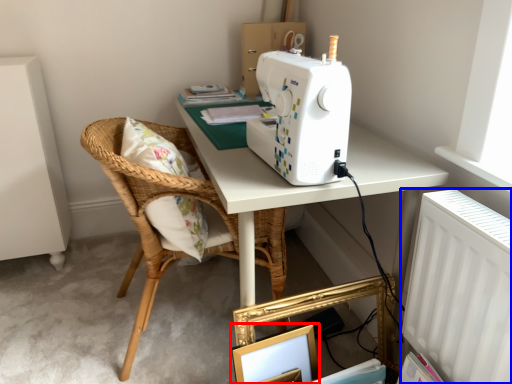
Question: Among these objects, which one is nearest to the camera, picture frame (highlighted by a red box) or radiator (highlighted by a blue box)?

Choices:
 (A) picture frame
 (B) radiator

Answer: (B)